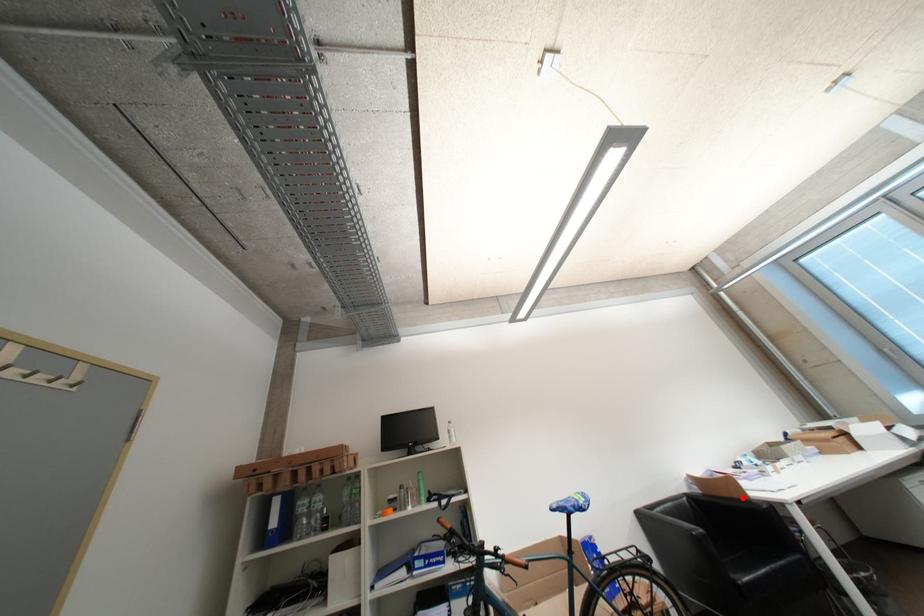
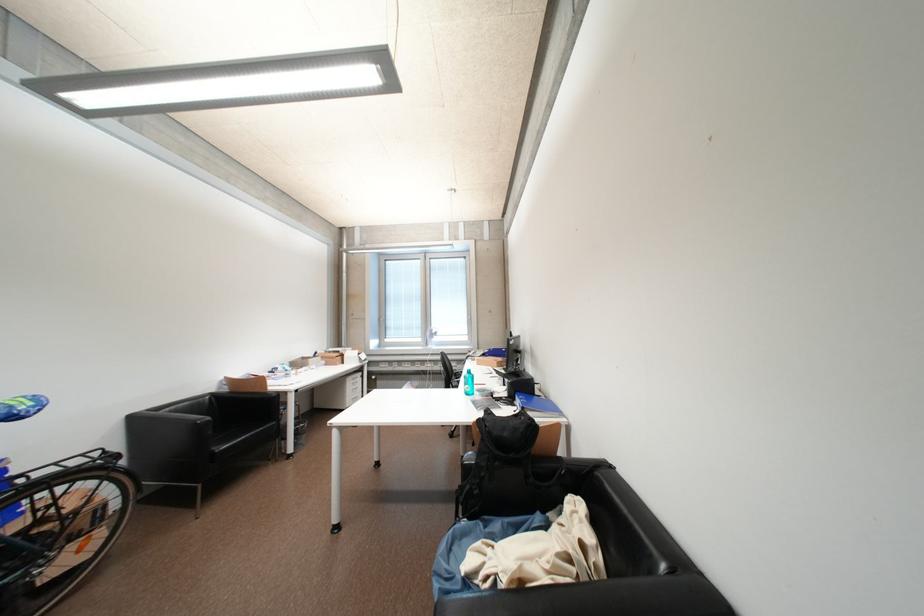
Find the pixel in the second image that matches the highlighted location in the first image.

(264, 392)